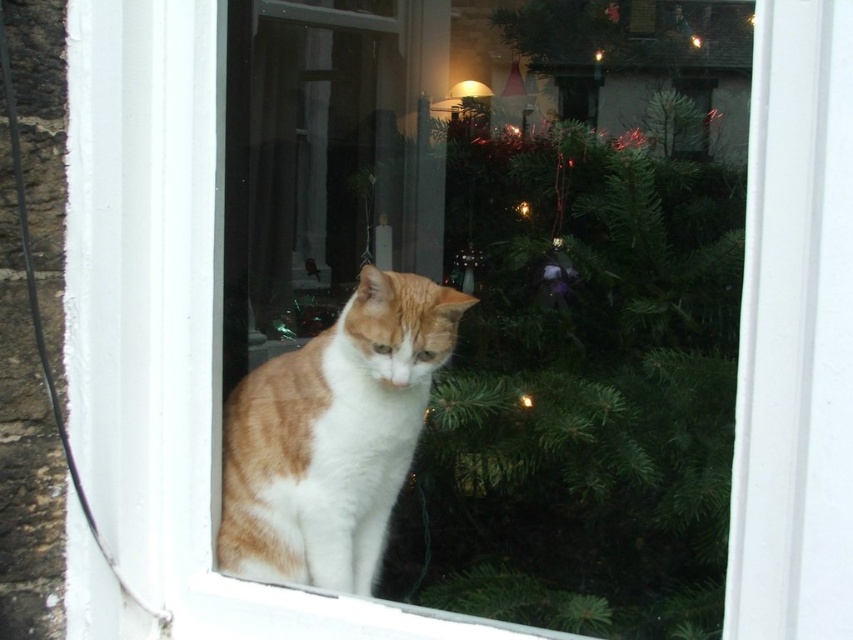
Who is higher up, green textured pine tree at center or orange-white fur cat at center?

green textured pine tree at center

Where is `green textured pine tree at center`? This screenshot has height=640, width=853. green textured pine tree at center is located at coordinates (583, 381).

You are a GUI agent. You are given a task and a screenshot of the screen. Output one action in this format:
    pyautogui.click(x=<x>, y=<y>)
    Task: Click on the green textured pine tree at center
    The image size is (853, 640).
    Given the screenshot: What is the action you would take?
    pyautogui.click(x=583, y=381)

Locate an element on the screen. green textured pine tree at center is located at coordinates (583, 381).